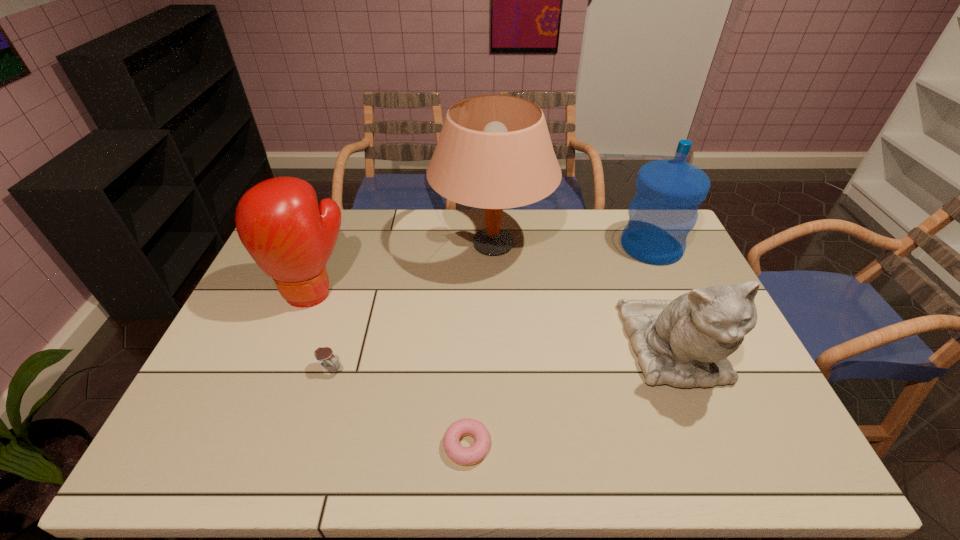
Image resolution: width=960 pixels, height=540 pixels. Identify the location of blank space located on the front of the water jug. (680, 308).

Locate an element on the screen. free point located on the striking surface of the boxing glove is located at coordinates (276, 385).

Locate an element on the screen. This screenshot has height=540, width=960. free space located 0.150m on the front-facing side of the cat is located at coordinates (721, 466).

The image size is (960, 540). Find the location of `free space located on the right of the watch`. free space located on the right of the watch is located at coordinates (445, 369).

Identify the location of free space located on the right of the nearest object. This screenshot has width=960, height=540. (521, 446).

Locate an element on the screen. The height and width of the screenshot is (540, 960). lampshade that is at the far edge is located at coordinates (494, 151).

At what (x,y) coordinates should I click in order to perform the action: click on water jug located at the far edge. Please return your answer as a coordinate pair (x, y). Looking at the image, I should click on 663,211.

Locate an element on the screen. The height and width of the screenshot is (540, 960). object present at the near edge is located at coordinates (455, 451).

At what (x,y) coordinates should I click in order to perform the action: click on object that is at the left edge. Please return your answer as a coordinate pair (x, y). This screenshot has height=540, width=960. Looking at the image, I should click on (291, 238).

This screenshot has width=960, height=540. Identify the location of water jug located in the right edge section of the desktop. (663, 211).